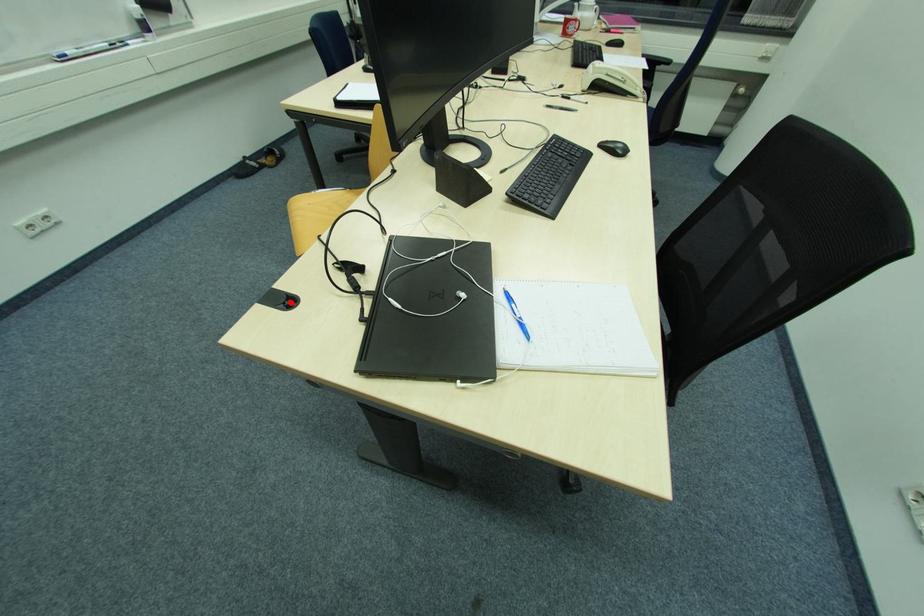
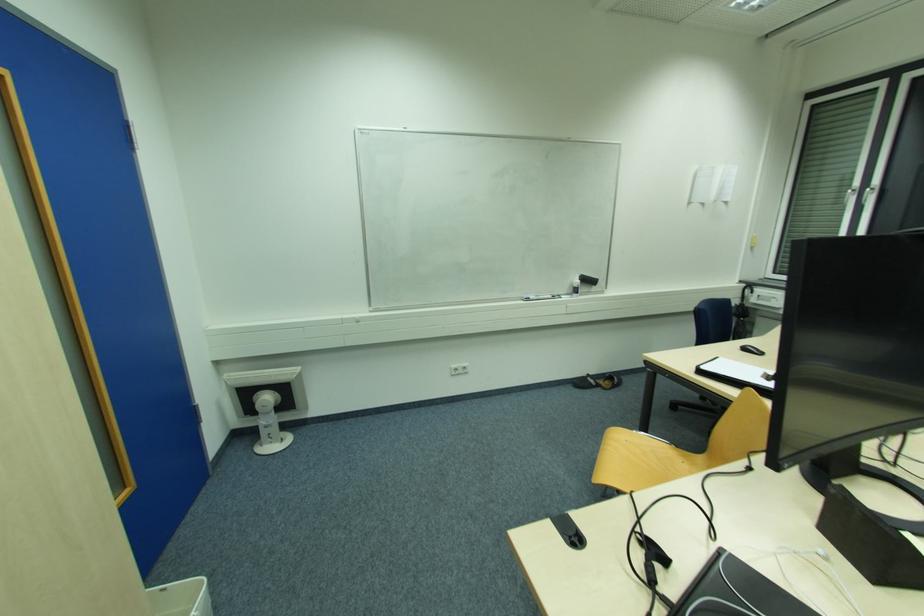
Where in the second image is the point corresponding to the highlighted location from the first image?

(578, 541)